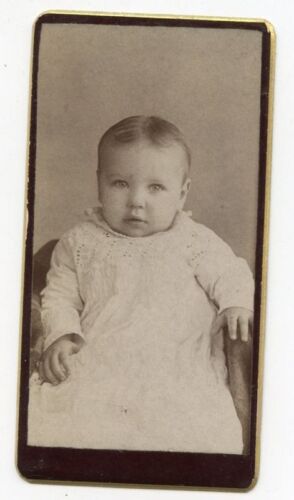
The image size is (294, 500). What are the coordinates of `chair` in the screenshot? It's located at point(237,356).